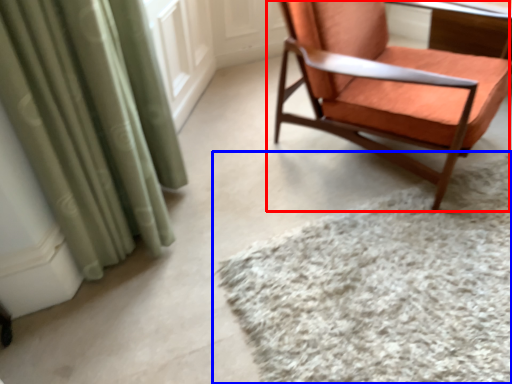
Question: Which point is further to the camera, chair (highlighted by a red box) or mat (highlighted by a blue box)?

Choices:
 (A) chair
 (B) mat

Answer: (A)